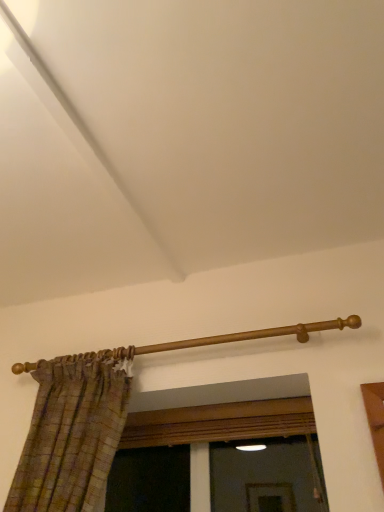
Question: From the image's perspective, is wooden curtain rod at upper center above or below wooden frame at center?

Choices:
 (A) above
 (B) below

Answer: (A)

Question: Is wooden curtain rod at upper center spatially inside wooden frame at center, or outside of it?

Choices:
 (A) inside
 (B) outside

Answer: (B)

Question: Looking at their shapes, would you say wooden curtain rod at upper center is wider or thinner than wooden frame at center?

Choices:
 (A) thin
 (B) wide

Answer: (A)

Question: From their relative heights in the image, would you say wooden frame at center is taller or shorter than wooden curtain rod at upper center?

Choices:
 (A) tall
 (B) short

Answer: (A)

Question: From the image's perspective, is wooden frame at center positioned above or below wooden curtain rod at upper center?

Choices:
 (A) above
 (B) below

Answer: (B)

Question: From a real-world perspective, is wooden frame at center above or below wooden curtain rod at upper center?

Choices:
 (A) below
 (B) above

Answer: (A)

Question: In the image, is wooden frame at center on the left side or the right side of wooden curtain rod at upper center?

Choices:
 (A) right
 (B) left

Answer: (A)